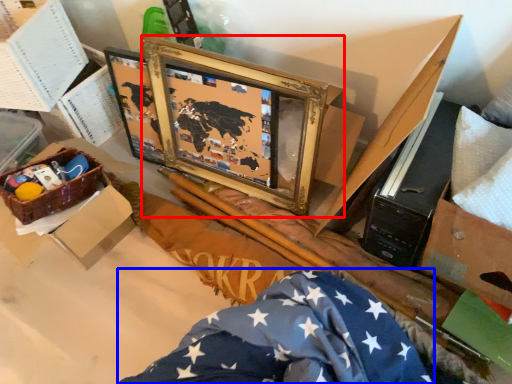
Question: Which object appears closest to the camera in this image, picture frame (highlighted by a red box) or flag (highlighted by a blue box)?

Choices:
 (A) picture frame
 (B) flag

Answer: (B)